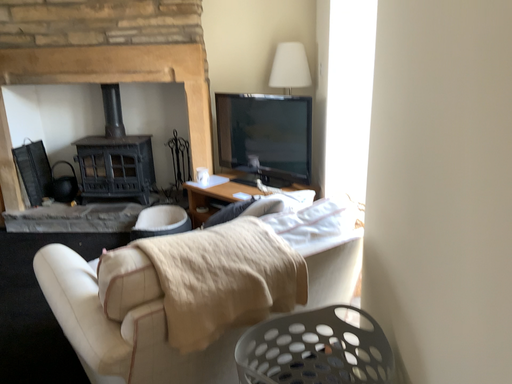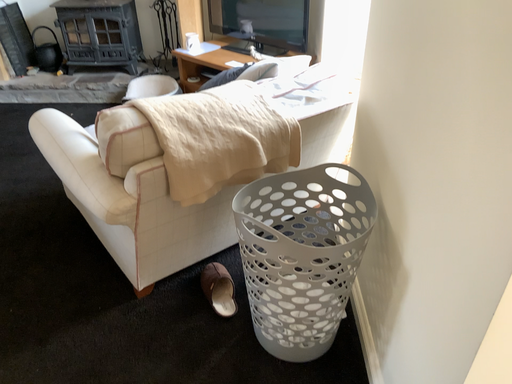
Question: How did the camera likely rotate when shooting the video?

Choices:
 (A) rotated upward
 (B) rotated downward

Answer: (B)